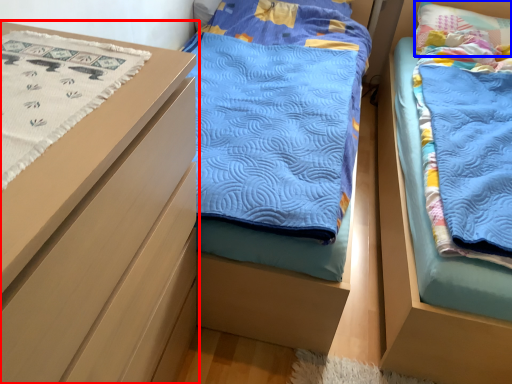
Question: Among these objects, which one is nearest to the camera, chest of drawers (highlighted by a red box) or pillow (highlighted by a blue box)?

Choices:
 (A) chest of drawers
 (B) pillow

Answer: (A)